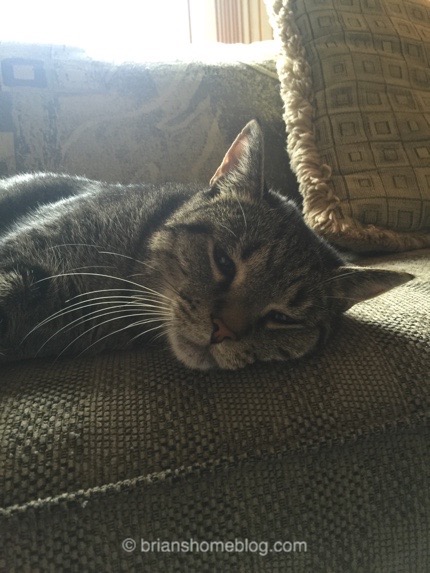
This screenshot has width=430, height=573. I want to click on pillow, so click(x=356, y=103).